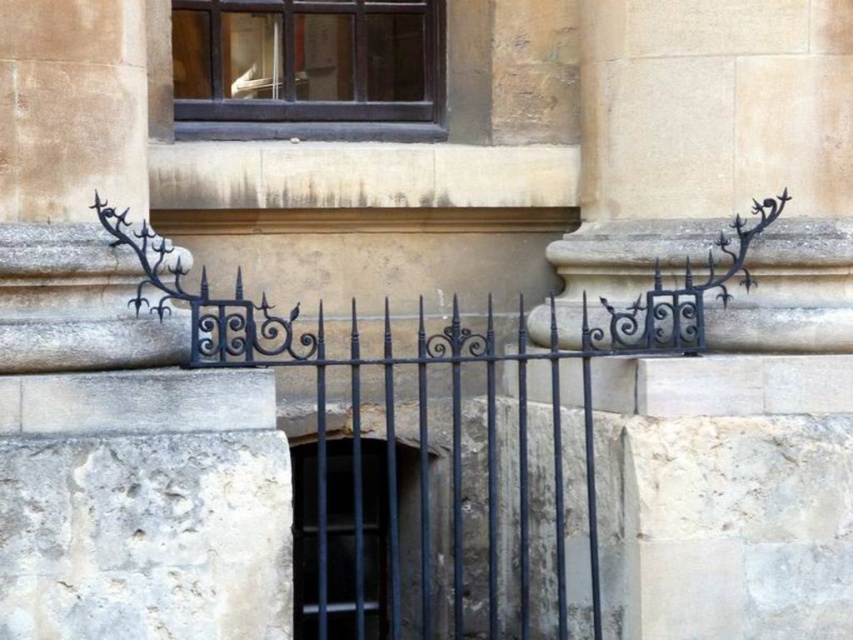
Is dark brown wood window at upper center taller than black metal bars at center?

In fact, dark brown wood window at upper center may be shorter than black metal bars at center.

Is point (410, 131) positioned after point (300, 563)?

No, (410, 131) is closer to viewer.

The image size is (853, 640). What do you see at coordinates (308, 68) in the screenshot?
I see `dark brown wood window at upper center` at bounding box center [308, 68].

Where is `dark brown wood window at upper center`? dark brown wood window at upper center is located at coordinates (308, 68).